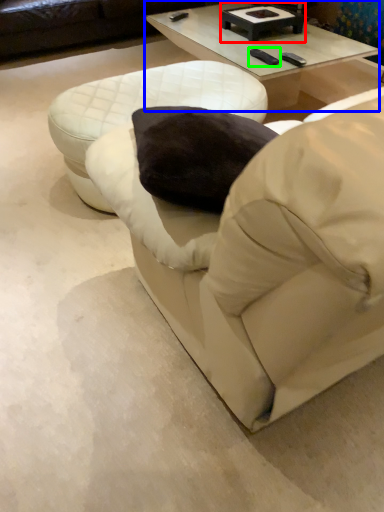
Question: Which object is the farthest from round table (highlighted by a red box)? Choose among these: coffee table (highlighted by a blue box) or pad (highlighted by a green box).

Choices:
 (A) coffee table
 (B) pad

Answer: (B)